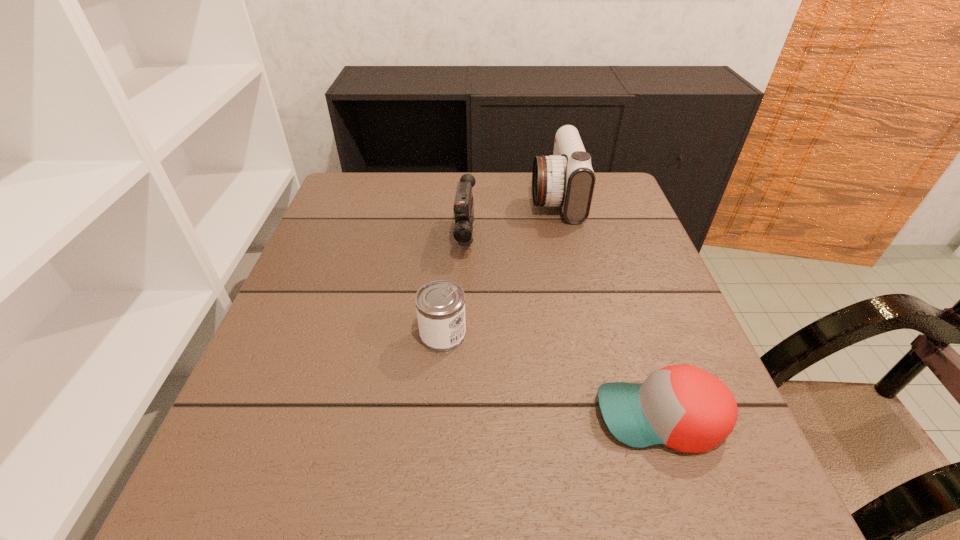
Locate an element on the screen. This screenshot has width=960, height=540. free point located 0.330m on the surface of the taller camcorder is located at coordinates (414, 198).

At what (x,y) coordinates should I click in order to perform the action: click on vacant space located on the front-facing side of the left camcorder. Please return your answer as a coordinate pair (x, y). Looking at the image, I should click on (462, 349).

Locate an element on the screen. The width and height of the screenshot is (960, 540). free location located on the back of the can is located at coordinates (451, 239).

At what (x,y) coordinates should I click in order to perform the action: click on blank area located at the brim of the baseball cap. Please return your answer as a coordinate pair (x, y). Looking at the image, I should click on (363, 417).

Identify the location of free space located at the brim of the baseball cap. (531, 417).

Find the location of a particular element. The height and width of the screenshot is (540, 960). free location located at the brim of the baseball cap is located at coordinates (422, 417).

The image size is (960, 540). Identify the location of camcorder at the right edge. (566, 178).

This screenshot has width=960, height=540. I want to click on baseball cap at the right edge, so click(x=683, y=407).

The width and height of the screenshot is (960, 540). Identify the location of object present at the far right corner. (566, 178).

Identify the location of vacant space at the far edge. This screenshot has width=960, height=540. (395, 188).